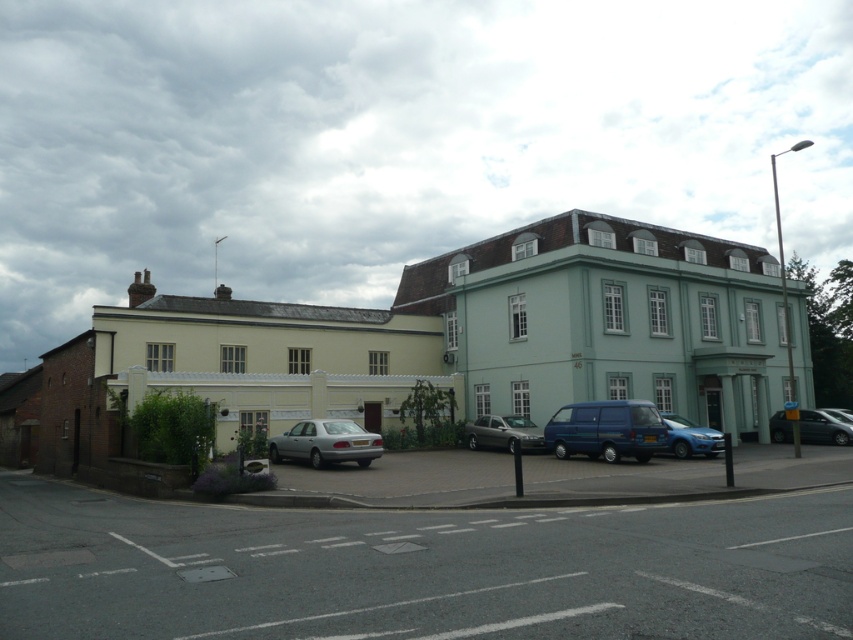
You are standing in front of the two story building and looking at the parking area. There are two points marked on the pavement. The first point is at coordinate point [641,449] and the second point is at coordinate point [357,454]. Which point is closer to you?

Point [357,454] is closer to you because it is less further to the camera than point [641,449].

You are a delivery person trying to park your truck in the parking area near the two story building. The truck requires a space larger than the blue metallic van at center. Can you park your truck in the gray asphalt parking lot at lower left?

The gray asphalt parking lot at lower left is larger in size than the blue metallic van at center, so yes, the truck can park in the gray asphalt parking lot at lower left since it is bigger than the van.